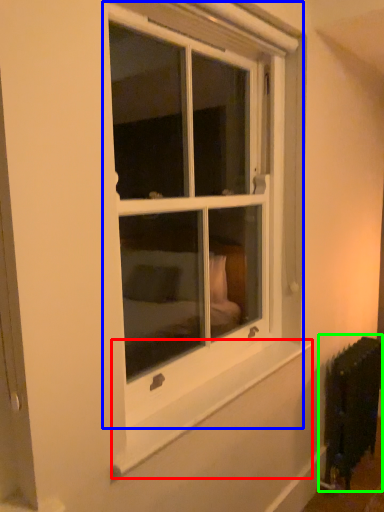
Question: Estimate the real-world distances between objects in this image. Which object is farther from window sill (highlighted by a red box), window (highlighted by a blue box) or radiator (highlighted by a green box)?

Choices:
 (A) window
 (B) radiator

Answer: (A)